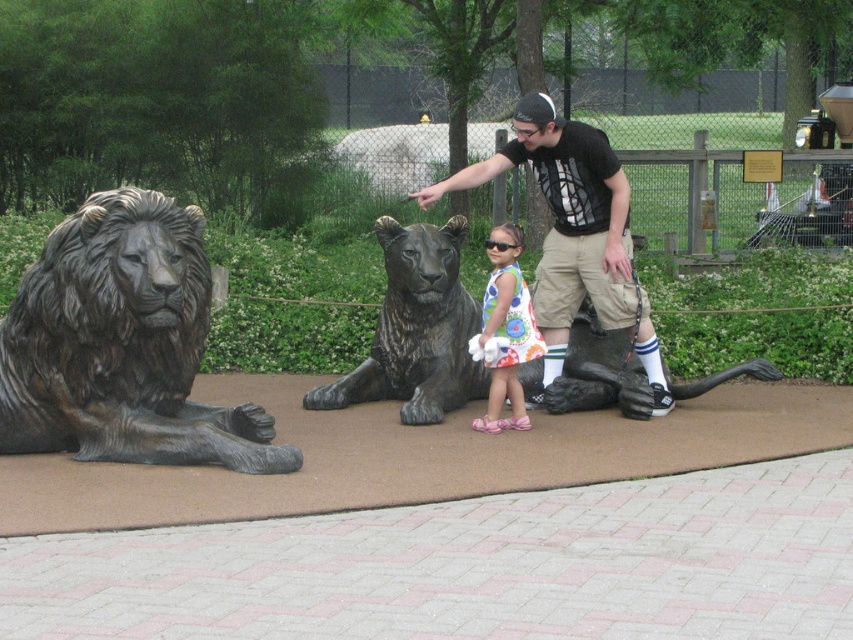
You are a tour guide explaining the statues to visitors. You notice a bronze lion at left and a floral dress at center. Which object is closer to the left edge of the image?

The bronze lion at left is positioned on the left side of the floral dress at center, so it is closer to the left edge of the image.